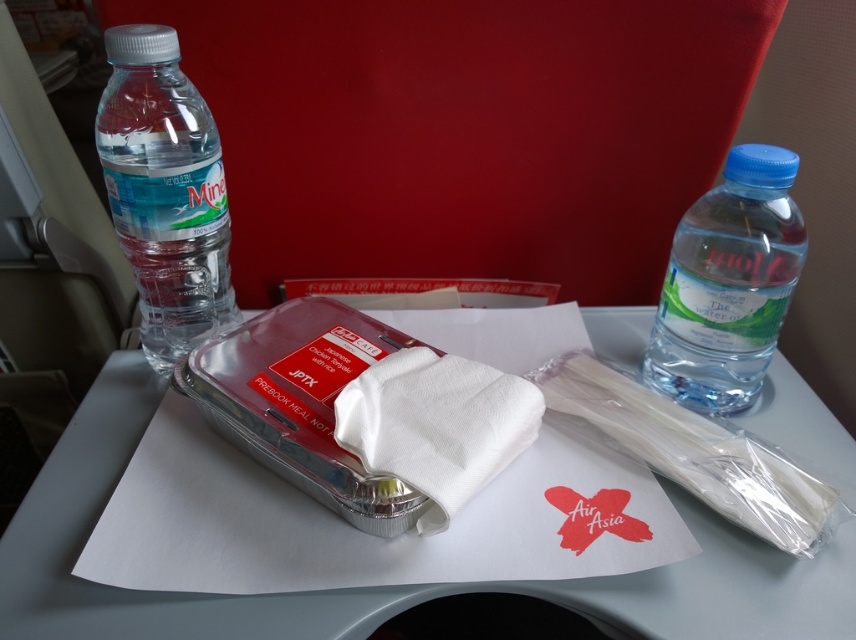
You are a flight attendant and need to hand out a meal tray to a passenger. The passenger asks you to place their utensils exactly 15.68 inches away from them. Can you use the point marked at coordinates point (648, 630) to position the utensils correctly?

Yes, the point marked at coordinates point (648, 630) is exactly 15.68 inches away from the viewer, so placing the utensils there would meet the passenger request.

You are a flight attendant trying to reach a specific point on the meal tray. The point is located at coordinates point (788, 580). If your hand is 12 inches away from the camera, can you reach that point without moving your hand closer?

The point (788, 580) is 16.77 inches away from the camera. Since your hand is only 12 inches away, you cannot reach it without moving your hand closer.